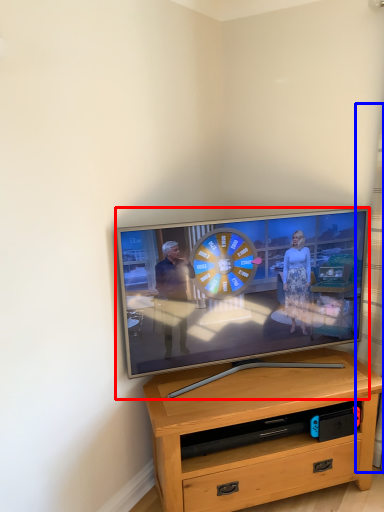
Question: Which object appears farthest to the camera in this image, television (highlighted by a red box) or curtain (highlighted by a blue box)?

Choices:
 (A) television
 (B) curtain

Answer: (A)